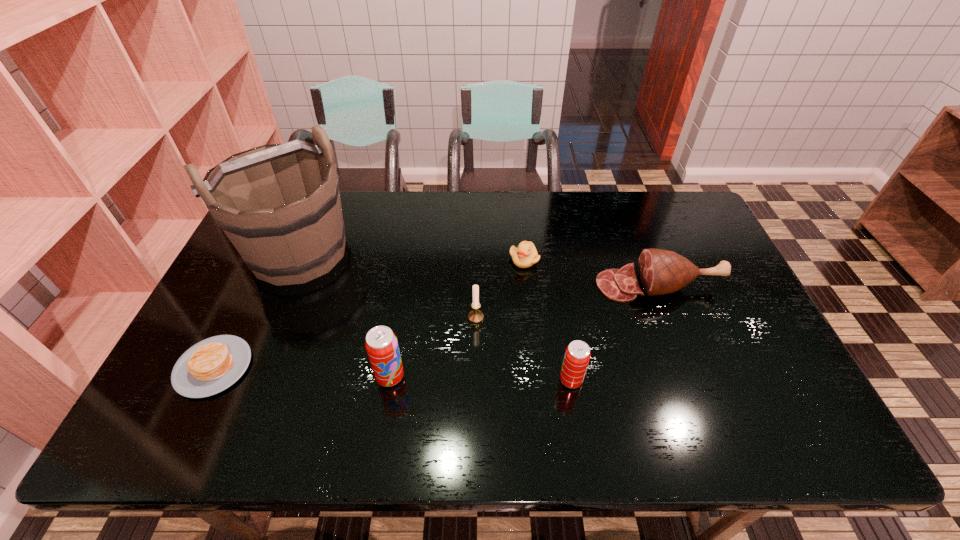
At what (x,y) coordinates should I click in order to perform the action: click on pancake. Please return your answer as a coordinate pair (x, y). The width and height of the screenshot is (960, 540). Looking at the image, I should click on (212, 365).

This screenshot has width=960, height=540. I want to click on vacant space located on the right of the second tallest object, so click(x=526, y=376).

The width and height of the screenshot is (960, 540). In order to click on free point located 0.150m on the right of the sixth object from left to right in this screenshot , I will do `click(644, 380)`.

At what (x,y) coordinates should I click in order to perform the action: click on vacant point located on the front of the bucket. Please return your answer as a coordinate pair (x, y). The width and height of the screenshot is (960, 540). Looking at the image, I should click on (252, 364).

The width and height of the screenshot is (960, 540). I want to click on free spot located 0.170m on the beak of the fifth object from left to right, so click(x=530, y=313).

Find the location of a particular element. This screenshot has width=960, height=540. free space located 0.080m at the sliced end of the rightmost object is located at coordinates (569, 285).

Where is `free location located 0.170m at the sliced end of the rightmost object`? free location located 0.170m at the sliced end of the rightmost object is located at coordinates (539, 285).

Find the location of a particular element. This screenshot has height=540, width=960. vacant position located at the sliced end of the rightmost object is located at coordinates (559, 285).

Locate an element on the screen. This screenshot has width=960, height=540. vacant space situated 0.230m on the front of the fourth object from left to right is located at coordinates (475, 401).

Locate an element on the screen. blank space located on the right of the shortest object is located at coordinates (378, 367).